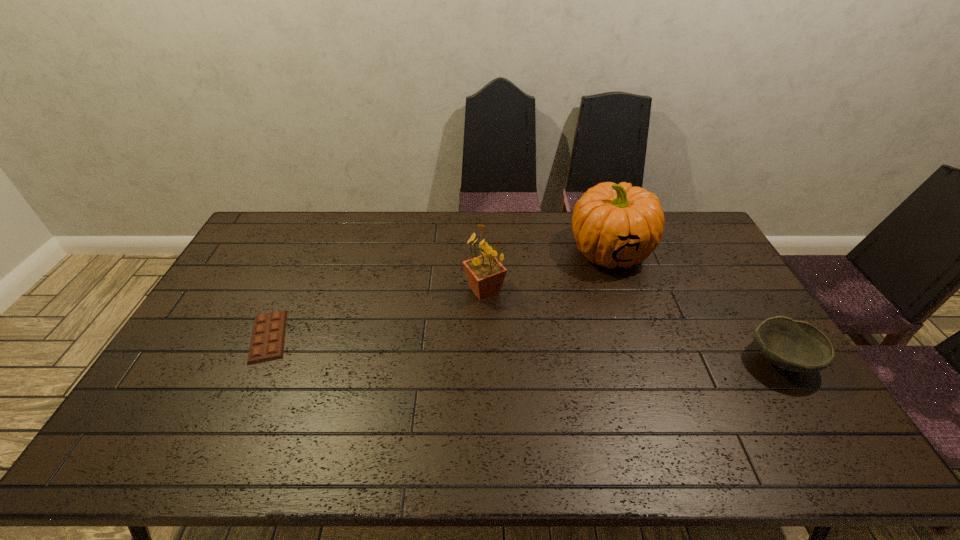
Where is `vacant spot on the desktop that is between the shortest object and the rightmost object and is positioned on the surface of the pumpkin`? The image size is (960, 540). vacant spot on the desktop that is between the shortest object and the rightmost object and is positioned on the surface of the pumpkin is located at coordinates (487, 347).

Locate an element on the screen. free space on the desktop that is between the shortest object and the rightmost object and is positioned at the front of the sunflower with flowers visible is located at coordinates (462, 345).